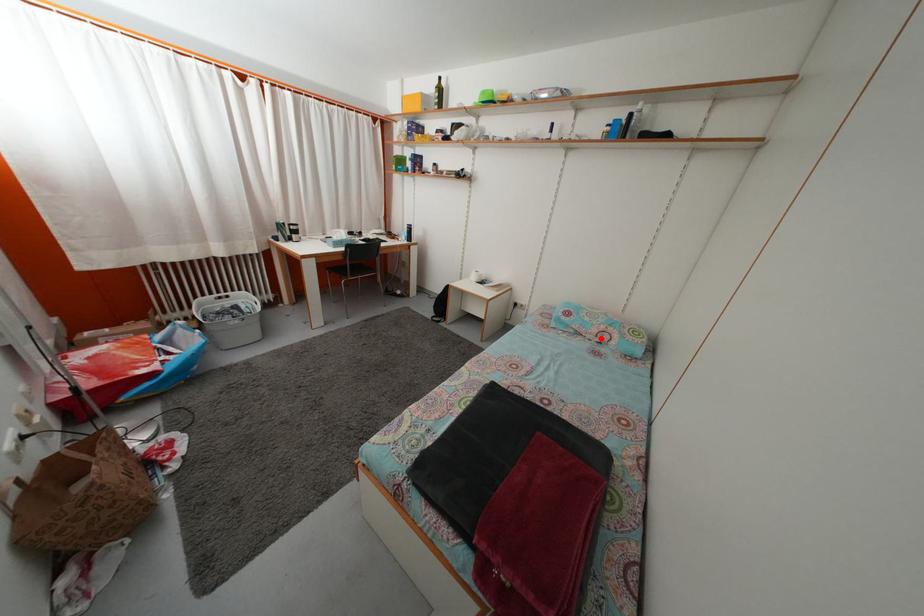
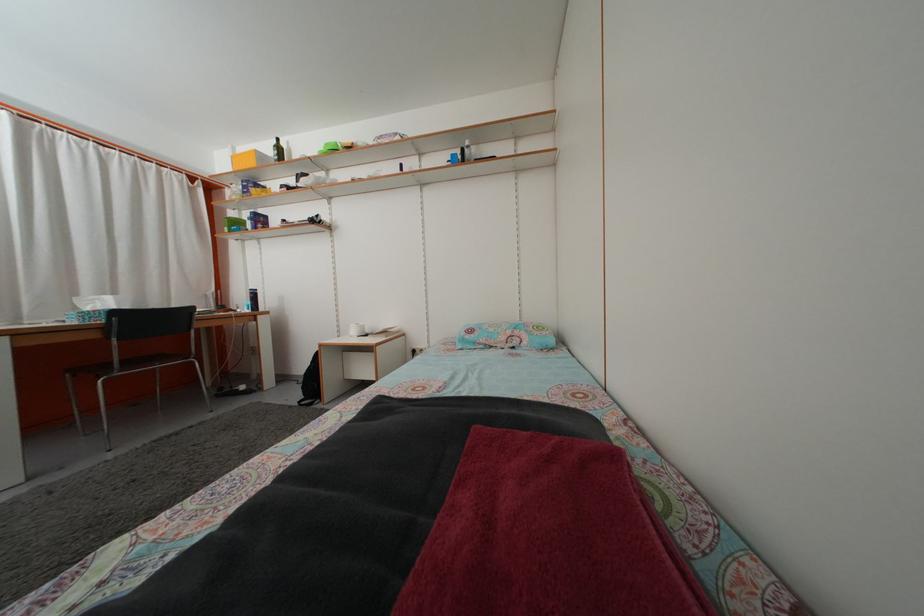
Question: I am providing you with two images of the same scene from different viewpoints. Given a red point in image1, look at the same physical point in image2. Is it:

Choices:
 (A) Closer to the viewpoint
 (B) Farther from the viewpoint

Answer: (B)